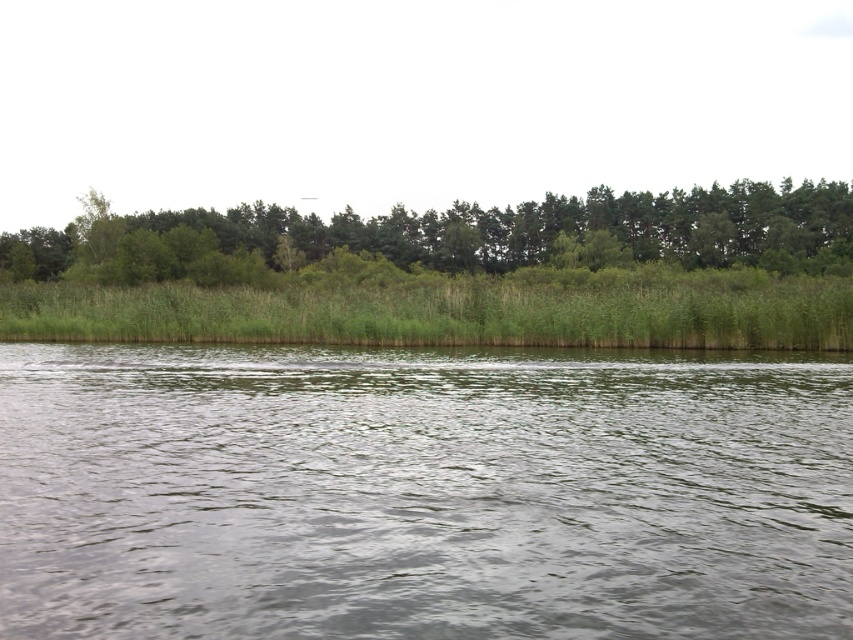
Where is `green water at center`? The height and width of the screenshot is (640, 853). green water at center is located at coordinates (422, 492).

Is green water at center above green leafy trees at upper center?

No.

This screenshot has width=853, height=640. Describe the element at coordinates (422, 492) in the screenshot. I see `green water at center` at that location.

The image size is (853, 640). What are the coordinates of `green water at center` in the screenshot? It's located at (422, 492).